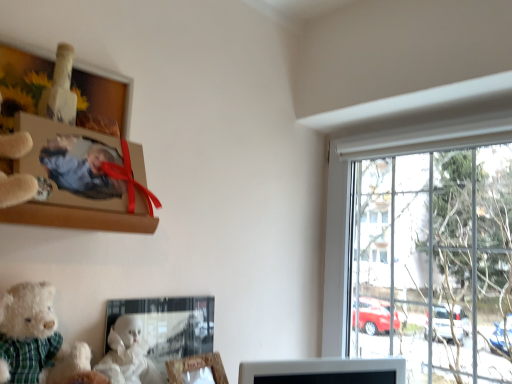
Question: Would you consider wooden picture frame at lower center, which is the 4th picture frame in top-to-bottom order, to be distant from white fluffy teddy bear at lower left?

Choices:
 (A) yes
 (B) no

Answer: (B)

Question: Is wooden picture frame at lower center, arranged as the 1th picture frame when ordered from the bottom, next to white fluffy teddy bear at lower left and touching it?

Choices:
 (A) no
 (B) yes

Answer: (A)

Question: From a real-world perspective, is wooden picture frame at lower center, arranged as the 1th picture frame when ordered from the bottom, located higher than white fluffy teddy bear at lower left?

Choices:
 (A) no
 (B) yes

Answer: (A)

Question: Is wooden picture frame at lower center, which is the 4th picture frame in top-to-bottom order, to the left of white fluffy teddy bear at lower left from the viewer's perspective?

Choices:
 (A) no
 (B) yes

Answer: (A)

Question: Considering the relative sizes of wooden picture frame at lower center, arranged as the 1th picture frame when ordered from the bottom, and white fluffy teddy bear at lower left in the image provided, is wooden picture frame at lower center, arranged as the 1th picture frame when ordered from the bottom, shorter than white fluffy teddy bear at lower left?

Choices:
 (A) yes
 (B) no

Answer: (A)

Question: Based on their sizes in the image, would you say white fluffy teddy bear at lower left is bigger or smaller than wooden picture frame at lower center, arranged as the 1th picture frame when ordered from the bottom?

Choices:
 (A) small
 (B) big

Answer: (B)

Question: Considering the positions of point pyautogui.click(x=7, y=337) and point pyautogui.click(x=214, y=365), is point pyautogui.click(x=7, y=337) closer or farther from the camera than point pyautogui.click(x=214, y=365)?

Choices:
 (A) farther
 (B) closer

Answer: (B)

Question: Considering the positions of white fluffy teddy bear at lower left and wooden picture frame at lower center, which is the 4th picture frame in top-to-bottom order, in the image, is white fluffy teddy bear at lower left wider or thinner than wooden picture frame at lower center, which is the 4th picture frame in top-to-bottom order,?

Choices:
 (A) thin
 (B) wide

Answer: (B)

Question: In terms of height, does white fluffy teddy bear at lower left look taller or shorter compared to wooden picture frame at lower center, arranged as the 1th picture frame when ordered from the bottom?

Choices:
 (A) short
 (B) tall

Answer: (B)

Question: Is wooden photo frame at upper left, the second picture frame when ordered from top to bottom, inside the boundaries of matte glass picture frame at lower center, placed as the 3th picture frame when sorted from top to bottom, or outside?

Choices:
 (A) inside
 (B) outside

Answer: (B)

Question: Is point [88, 170] closer or farther from the camera than point [175, 340]?

Choices:
 (A) farther
 (B) closer

Answer: (B)

Question: Is wooden photo frame at upper left, placed as the third picture frame when sorted from bottom to top, in front of or behind matte glass picture frame at lower center, which ranks as the 2th picture frame in bottom-to-top order, in the image?

Choices:
 (A) behind
 (B) front

Answer: (B)

Question: Is wooden photo frame at upper left, placed as the third picture frame when sorted from bottom to top, wider or thinner than matte glass picture frame at lower center, placed as the 3th picture frame when sorted from top to bottom?

Choices:
 (A) thin
 (B) wide

Answer: (B)

Question: Considering the positions of matte cardboard photo frame at upper left, the 4th picture frame from the bottom, and wooden photo frame at upper left, placed as the third picture frame when sorted from bottom to top, in the image, is matte cardboard photo frame at upper left, the 4th picture frame from the bottom, taller or shorter than wooden photo frame at upper left, placed as the third picture frame when sorted from bottom to top,?

Choices:
 (A) tall
 (B) short

Answer: (A)

Question: Is point (20, 213) positioned closer to the camera than point (48, 195)?

Choices:
 (A) closer
 (B) farther

Answer: (A)